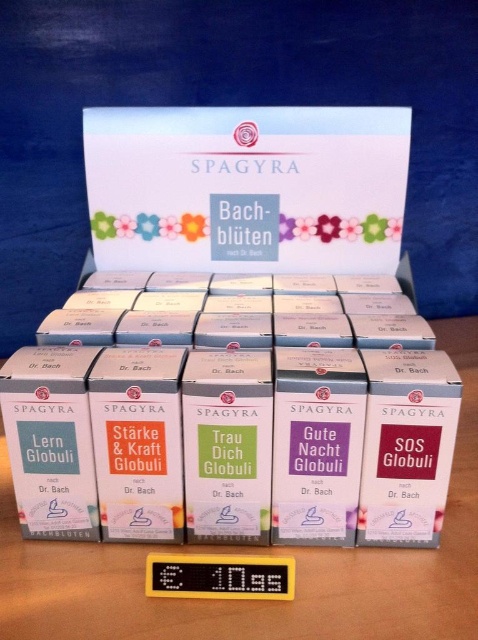
Question: Is white cardboard box at center smaller than white cardboard boxes at center?

Choices:
 (A) yes
 (B) no

Answer: (A)

Question: Does white cardboard box at center have a greater width compared to white cardboard boxes at center?

Choices:
 (A) yes
 (B) no

Answer: (B)

Question: Among these points, which one is farthest from the camera?

Choices:
 (A) (11, 608)
 (B) (359, 113)

Answer: (B)

Question: Which point appears closest to the camera in this image?

Choices:
 (A) (4, 564)
 (B) (130, 186)

Answer: (A)

Question: Is white cardboard box at center thinner than white cardboard boxes at center?

Choices:
 (A) yes
 (B) no

Answer: (A)

Question: Which point appears farthest from the camera in this image?

Choices:
 (A) (95, 544)
 (B) (144, 173)

Answer: (B)